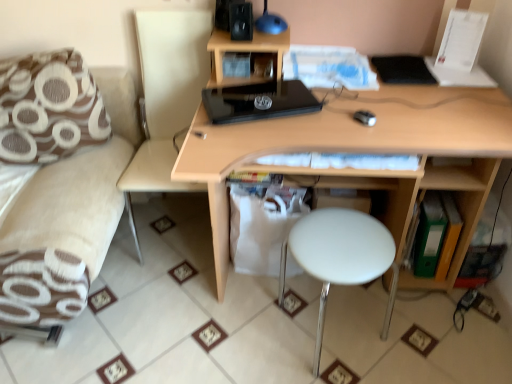
Image resolution: width=512 pixels, height=384 pixels. I want to click on vacant space that's between beige fabric swivel chair at left and light wood desk at center, so click(x=178, y=290).